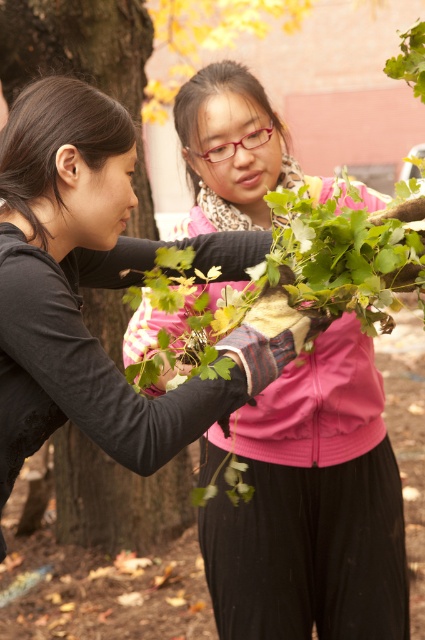
Based on the scene description, where exactly is the pink fabric at center located in terms of coordinates?

The pink fabric at center is located at coordinates point [312,506].

From the picture: You are a photographer standing in the scene. You want to take a photo of the brown rough tree trunk at left without the pink fabric at center blocking it. Is it possible to adjust your position to achieve this?

The pink fabric at center is in front of the brown rough tree trunk at left, so you can move to the side to position yourself where the pink fabric at center is no longer blocking the view of the brown rough tree trunk at left.